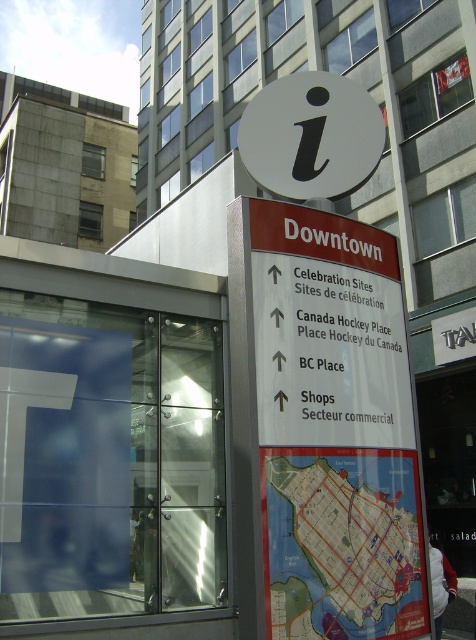
You are a tourist holding a map that is 12 inches tall. You see the map at center and the white matte sign at center in the image. Can your map fit vertically in the space between them if they are placed side by side?

The map at center has a greater height compared to white matte sign at center. Since your map is 12 inches tall, if the map at center is taller than 12 inches, your map can fit vertically between them. However, if the map at center is shorter, it might not. The exact height isn

You are holding a 10 cm wide brochure and want to place it on either the map at center or the white matte sign at center. Which surface can accommodate the brochure without overhanging?

The white matte sign at center has a greater width than the map at center. Since the brochure is 10 cm wide, it can fit on the white matte sign at center but may not fit on the map at center if the map is narrower than 10 cm. However, the exact width of the map isn not provided, so we can only confirm the sign is wider. The answer should state the sign is wider but cannot confirm the map is too narrow. Wait, the Objects Description says the map has lesser width than the white sign. So the brochure can fiton